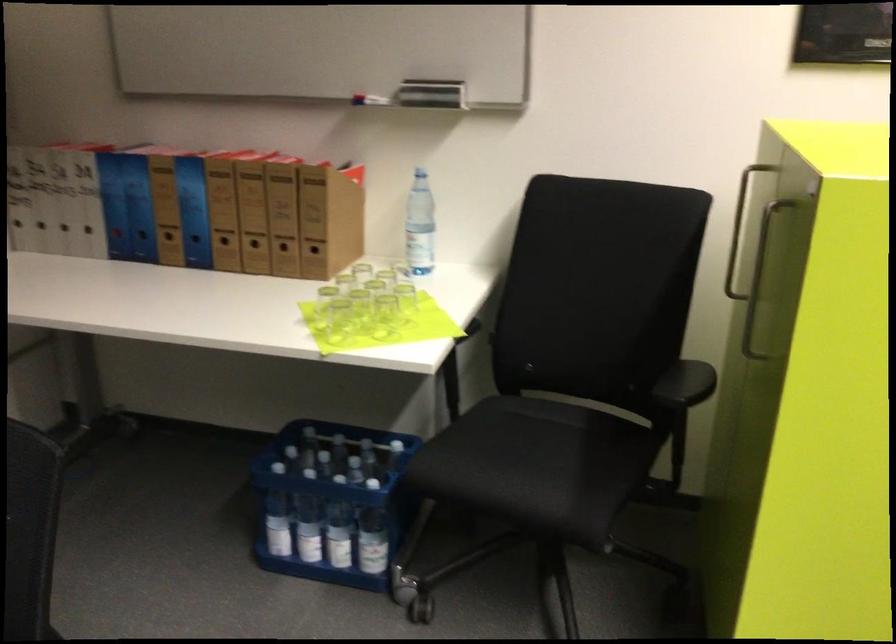
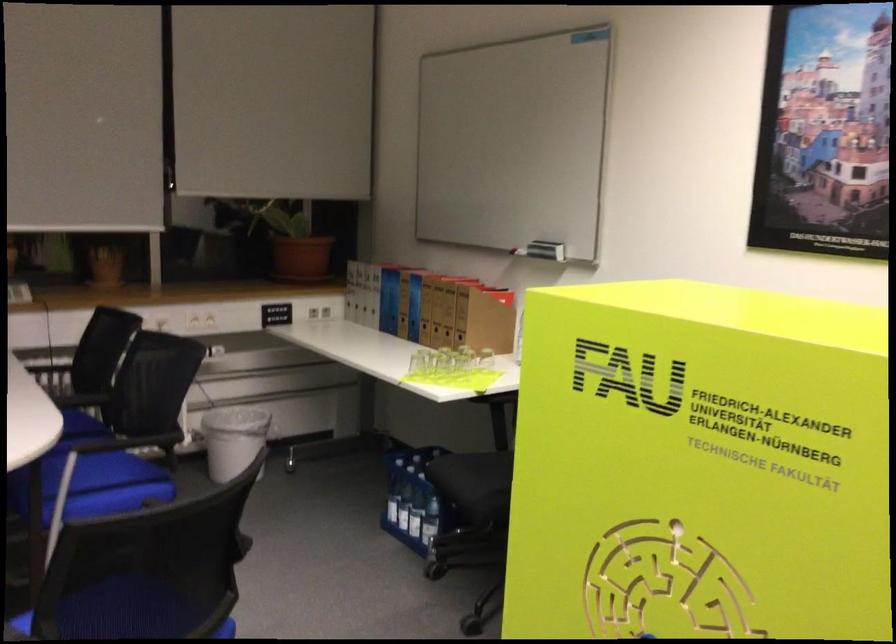
Where in the second image is the point corresponding to point 112,248 from the first image?

(382, 321)